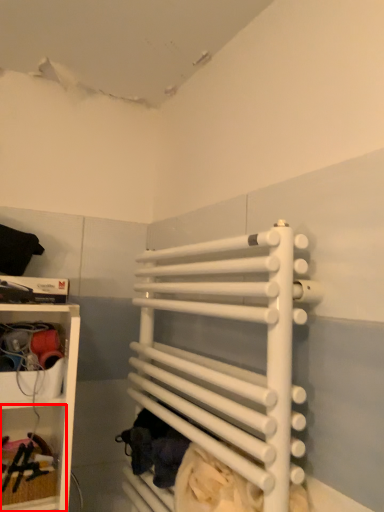
Question: Where is cabinet (annotated by the red box) located in relation to bunk bed in the image?

Choices:
 (A) right
 (B) left

Answer: (B)